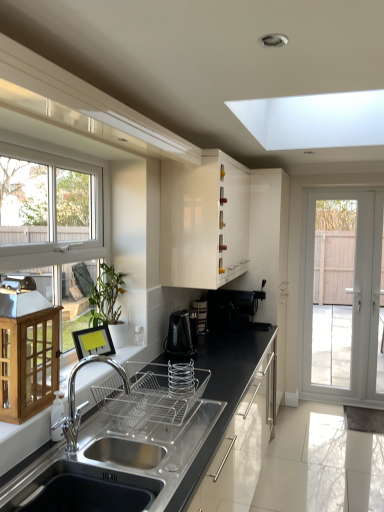
Where is `free space in front of clear plastic dish rack at center, the 4th appliance in the back-to-front sequence`? This screenshot has height=512, width=384. free space in front of clear plastic dish rack at center, the 4th appliance in the back-to-front sequence is located at coordinates (162, 444).